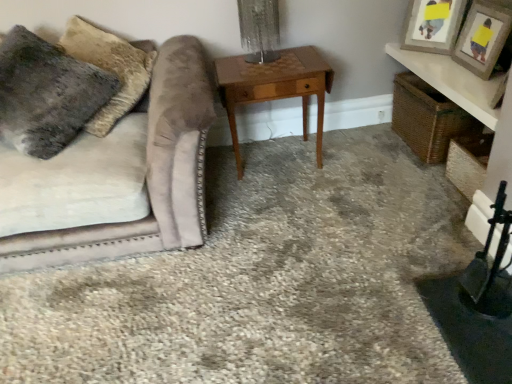
I want to click on blank space situated above light brown wood table at center (from a real-world perspective), so click(x=267, y=64).